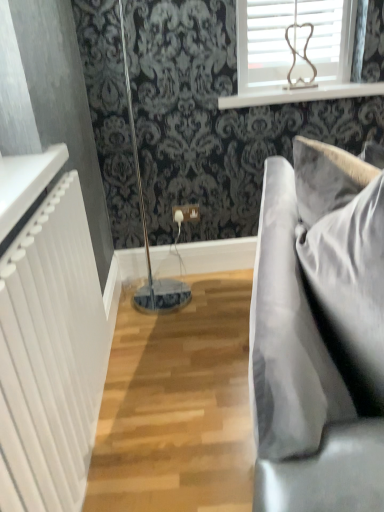
Question: Is white wood window sill at upper center inside velvet grey couch at right?

Choices:
 (A) no
 (B) yes

Answer: (A)

Question: Can you confirm if velvet grey couch at right is bigger than white wood window sill at upper center?

Choices:
 (A) no
 (B) yes

Answer: (B)

Question: Is the position of velvet grey couch at right more distant than that of white wood window sill at upper center?

Choices:
 (A) no
 (B) yes

Answer: (A)

Question: Is white wood window sill at upper center at the back of velvet grey couch at right?

Choices:
 (A) no
 (B) yes

Answer: (A)

Question: Can you confirm if velvet grey couch at right is wider than white wood window sill at upper center?

Choices:
 (A) no
 (B) yes

Answer: (B)

Question: Considering the relative positions of velvet grey couch at right and white wood window sill at upper center in the image provided, is velvet grey couch at right to the left of white wood window sill at upper center from the viewer's perspective?

Choices:
 (A) no
 (B) yes

Answer: (B)

Question: Is velvet grey couch at right looking in the opposite direction of velvet gray pillow at right?

Choices:
 (A) yes
 (B) no

Answer: (A)

Question: Is velvet grey couch at right not close to velvet gray pillow at right?

Choices:
 (A) no
 (B) yes

Answer: (A)

Question: Does velvet grey couch at right have a greater height compared to velvet gray pillow at right?

Choices:
 (A) yes
 (B) no

Answer: (A)

Question: Considering the relative sizes of velvet grey couch at right and velvet gray pillow at right in the image provided, is velvet grey couch at right wider than velvet gray pillow at right?

Choices:
 (A) no
 (B) yes

Answer: (B)

Question: Is the position of velvet grey couch at right more distant than that of velvet gray pillow at right?

Choices:
 (A) no
 (B) yes

Answer: (A)

Question: Is velvet grey couch at right to the left of velvet gray pillow at right from the viewer's perspective?

Choices:
 (A) yes
 (B) no

Answer: (B)

Question: Is velvet gray pillow at right positioned behind white textured radiator at left?

Choices:
 (A) no
 (B) yes

Answer: (B)